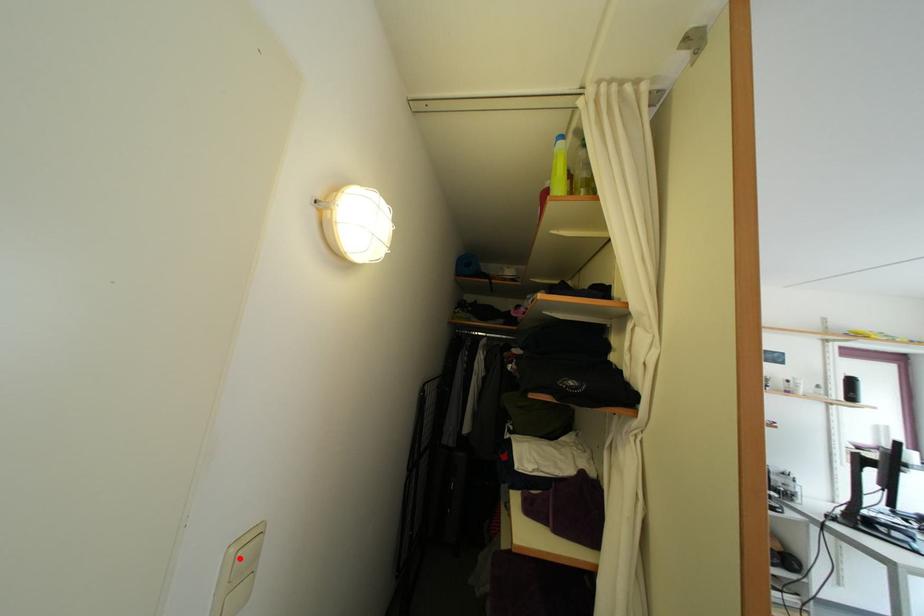
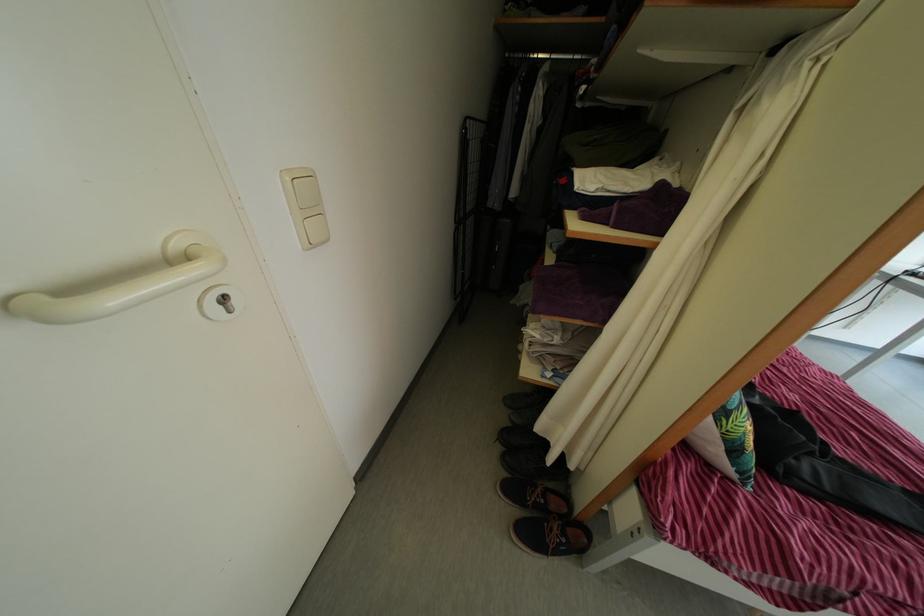
Locate, in the second image, the point that corresponds to the highlighted location in the first image.

(295, 187)